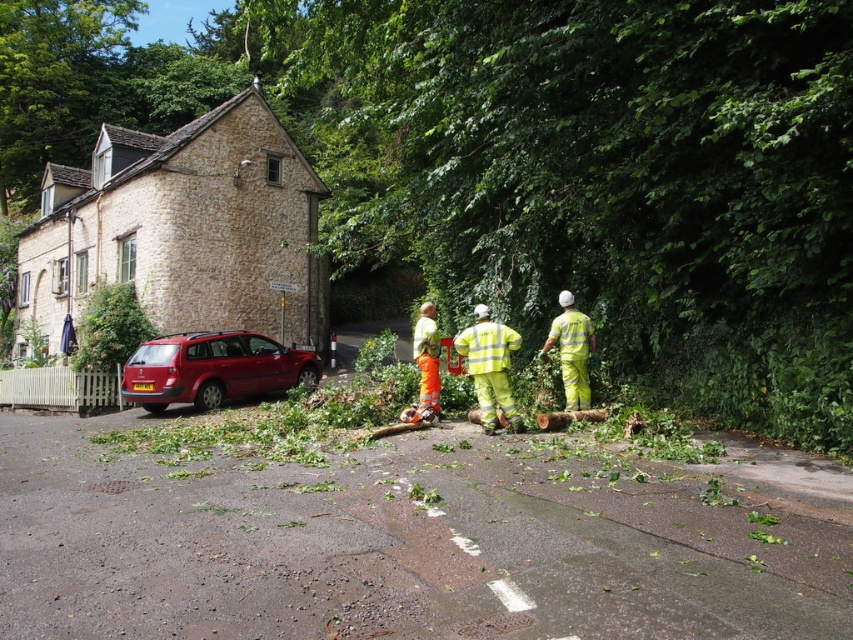
You are a pedestrian trying to cross the road at the center. There is a green leafy tree at center and yellow reflective pants at center. Which object is wider?

The green leafy tree at center is wider than the yellow reflective pants at center.

You are a pedestrian standing on the road and need to walk from point (460, 56) to point (498, 396). Which direction should you face to move towards your destination?

Since point (460, 56) is closer to you than point (498, 396), you should face away from the stone building to move towards your destination.

In the scene shown: You are standing at the point marked by the coordinates point (532, 163). Looking around, you see a red car parked near a traditional stone building with a white picket fence. Can you determine which direction the red car is relative to the point?

The point (532, 163) is on the green leafy tree at center. The red car is parked on the left side of the road near the building, so the red car is to the left of the point.